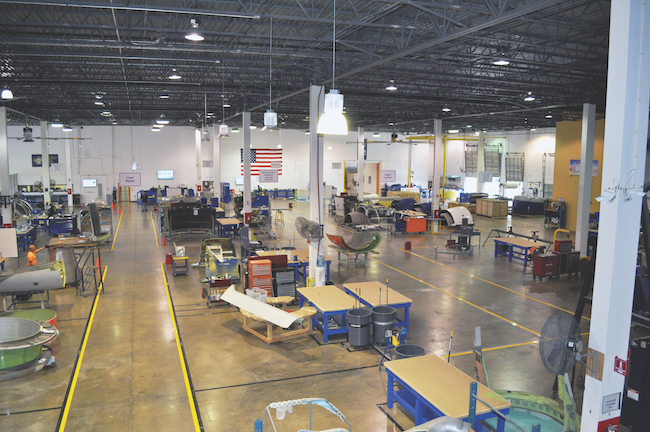
Identify the location of wall. The width and height of the screenshot is (650, 432). (394, 159).